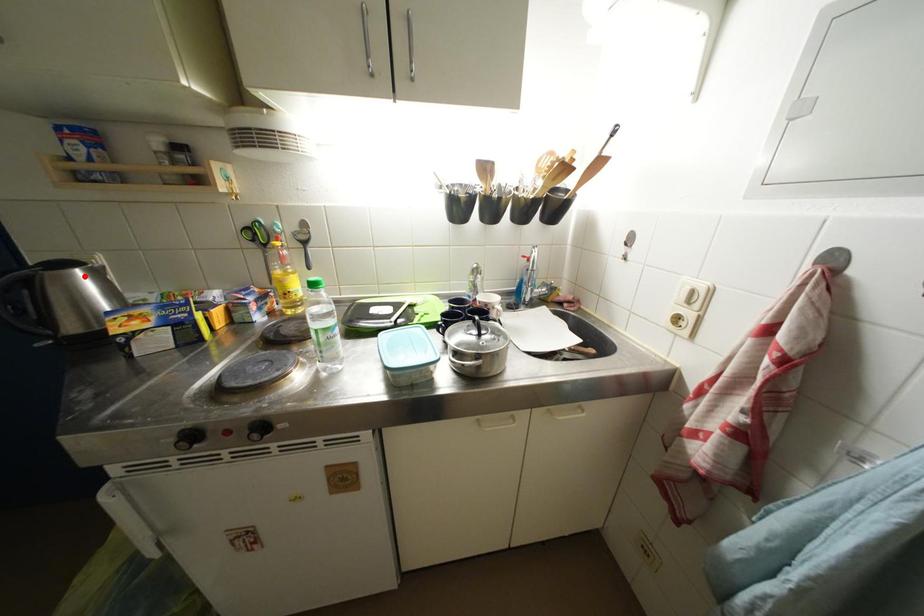
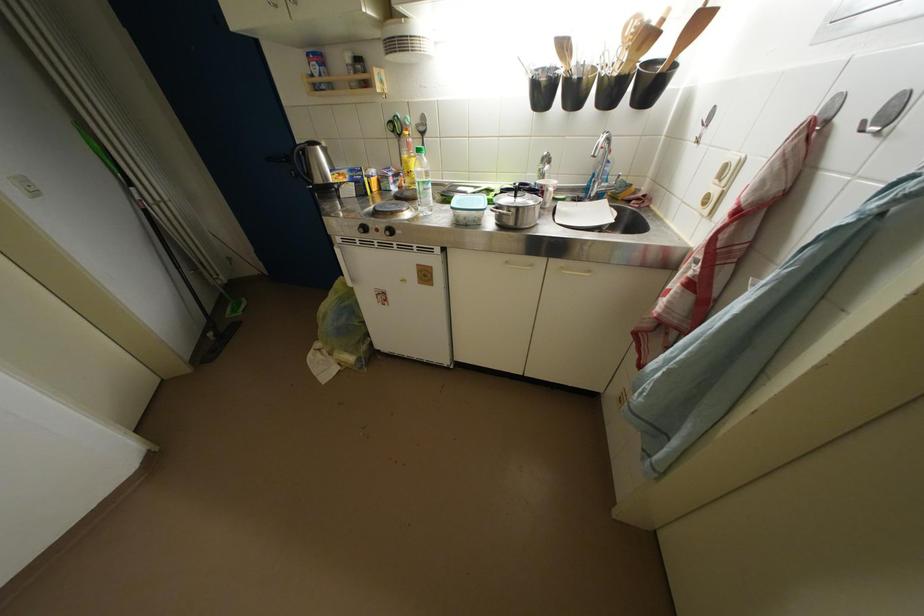
In the second image, find the point that corresponds to the highlighted location in the first image.

(324, 152)